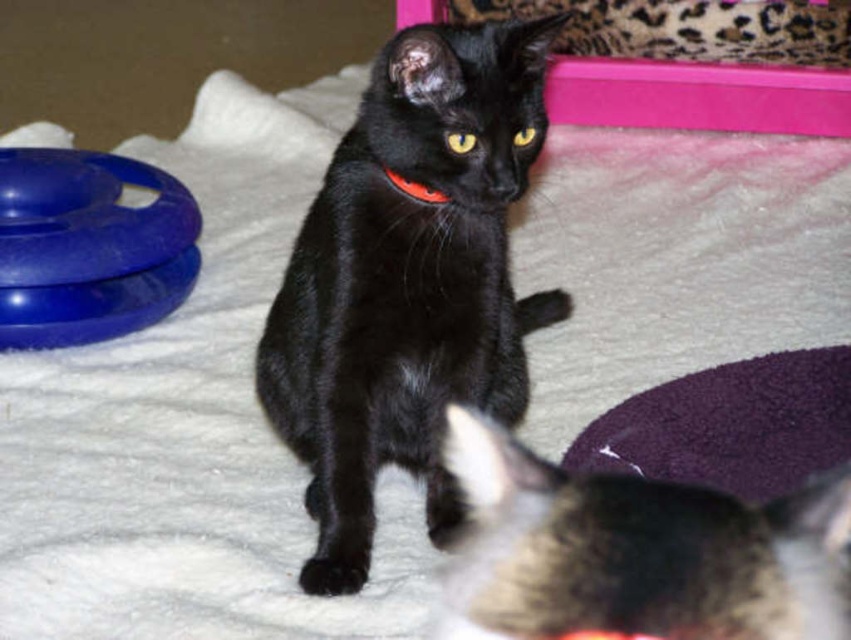
You are a cat owner who wants to place a new toy for your cat. The blue rubber ring at left is currently at position point (89, 246). If you want to place the new toy 20 cm to the right of the blue rubber ring at left, where should you place it?

The new toy should be placed at point 0.586, 0.105, which is 20 cm to the right of the blue rubber ring at left at point (89, 246).

You are a photographer setting up a shoot with a black glossy fur cat at center and a fluffy black cat at center. You need to position a light source so that it illuminates the cat with the most reflective fur. Which cat should you focus the light on?

The black glossy fur cat at center has a reflective surface due to its glossy fur, so focusing the light on it will create more shine and reflectivity compared to the fluffy black cat at center with non reflective fur.

You are a photographer trying to capture the black cat in the scene. You want to position yourself so that you can see both the point at [430,134] and the point at [466,476] in your shot. Based on their positions, which point should you focus on to ensure both are in the frame?

You should focus on the point at [466,476] because point at [430,134] is behind it, so by framing the foreground point, both points will be visible in the shot.